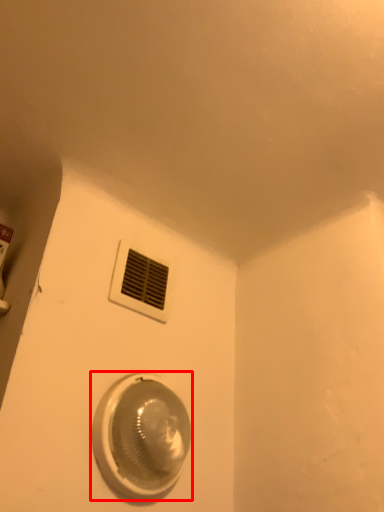
Question: From the image, what is the correct spatial relationship of home appliance (annotated by the red box) in relation to window?

Choices:
 (A) left
 (B) right

Answer: (B)